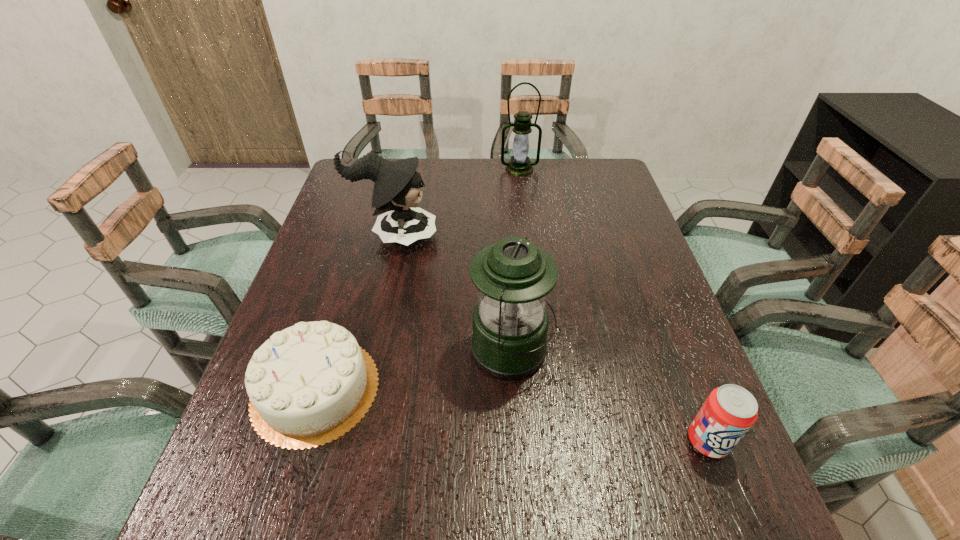
Find the location of a particular element. Image resolution: width=960 pixels, height=540 pixels. the farthest object is located at coordinates (520, 165).

The height and width of the screenshot is (540, 960). I want to click on the nearer lantern, so click(x=509, y=341).

You are a GUI agent. You are given a task and a screenshot of the screen. Output one action in this format:
    pyautogui.click(x=<x>, y=<y>)
    Task: Click on the doll
    
    Given the screenshot: What is the action you would take?
    pyautogui.click(x=397, y=184)

Locate an element on the screen. This screenshot has width=960, height=540. birthday cake is located at coordinates (309, 384).

Identify the location of soda can. (728, 413).

Where is `blank space located 0.120m on the side where the farther lantern emits light`? The image size is (960, 540). blank space located 0.120m on the side where the farther lantern emits light is located at coordinates (523, 197).

Where is `vacant space located on the back of the nearer lantern`? The image size is (960, 540). vacant space located on the back of the nearer lantern is located at coordinates (505, 244).

You are a GUI agent. You are given a task and a screenshot of the screen. Output one action in this format:
    pyautogui.click(x=<x>, y=<y>)
    Task: Click on the vacant position located at the face of the doll
    This screenshot has width=960, height=540.
    Given the screenshot: What is the action you would take?
    pyautogui.click(x=580, y=237)

You are a GUI agent. You are given a task and a screenshot of the screen. Output one action in this format:
    pyautogui.click(x=<x>, y=<y>)
    Task: Click on the vacant space located 0.250m on the right of the birthday cake
    The width and height of the screenshot is (960, 540).
    Given the screenshot: What is the action you would take?
    pyautogui.click(x=502, y=389)

Where is `free space located 0.060m on the surface of the soda can`? The height and width of the screenshot is (540, 960). free space located 0.060m on the surface of the soda can is located at coordinates (730, 496).